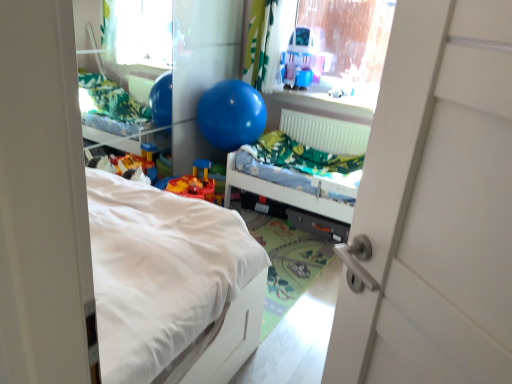
This screenshot has width=512, height=384. Describe the element at coordinates (325, 133) in the screenshot. I see `white plastic radiator at upper center` at that location.

The image size is (512, 384). Describe the element at coordinates (294, 185) in the screenshot. I see `blue rubber ball at center` at that location.

Measure the distance between translucent plastic playhouse at upper center and camera.

translucent plastic playhouse at upper center is 3.65 meters away from camera.

Where is `white plastic radiator at upper center`? This screenshot has height=384, width=512. white plastic radiator at upper center is located at coordinates (325, 133).

How many degrees apart are the facing directions of blue rubber balloon at upper center and green fabric curtain at upper center?

1.39 degrees.

Identify the location of curtain that is behind the blue rubber balloon at upper center. This screenshot has height=384, width=512. (259, 41).

Is blue rubber balloon at upper center outside of green fabric curtain at upper center?

blue rubber balloon at upper center is positioned outside green fabric curtain at upper center.

From a real-world perspective, is blue rubber balloon at upper center physically located above or below green fabric curtain at upper center?

From a real-world perspective, blue rubber balloon at upper center is physically below green fabric curtain at upper center.

In the image, is translucent plastic playhouse at upper center positioned in front of or behind transparent plastic window screen at upper center?

translucent plastic playhouse at upper center is behind transparent plastic window screen at upper center.

Does translucent plastic playhouse at upper center have a greater height compared to transparent plastic window screen at upper center?

No.

Is translucent plastic playhouse at upper center positioned with its back to transparent plastic window screen at upper center?

Yes, transparent plastic window screen at upper center is at the back of translucent plastic playhouse at upper center.

Considering the relative positions of translucent plastic playhouse at upper center and transparent plastic window screen at upper center in the image provided, is translucent plastic playhouse at upper center to the left of transparent plastic window screen at upper center from the viewer's perspective?

Yes, translucent plastic playhouse at upper center is to the left of transparent plastic window screen at upper center.

Choose the correct answer: Is green fabric curtain at upper center inside blue rubber ball at center or outside it?

green fabric curtain at upper center is located beyond the bounds of blue rubber ball at center.

From a real-world perspective, which is physically below, green fabric curtain at upper center or blue rubber ball at center?

blue rubber ball at center is physically lower.

Would you say green fabric curtain at upper center is a long distance from blue rubber ball at center?

No, green fabric curtain at upper center is in close proximity to blue rubber ball at center.

Consider the image. Considering the sizes of objects green fabric curtain at upper center and blue rubber ball at center in the image provided, who is taller, green fabric curtain at upper center or blue rubber ball at center?

green fabric curtain at upper center.

Is point (237, 168) closer to camera compared to point (312, 76)?

Yes, it is in front of point (312, 76).

Is blue rubber ball at center directly adjacent to translucent plastic playhouse at upper center?

There is a gap between blue rubber ball at center and translucent plastic playhouse at upper center.

From a real-world perspective, does blue rubber ball at center stand above translucent plastic playhouse at upper center?

No, from a real-world perspective, blue rubber ball at center is not over translucent plastic playhouse at upper center

Identify the location of toy on the right of blue rubber ball at center. The width and height of the screenshot is (512, 384). (303, 60).

Which object is wider, blue rubber balloon at upper center or translucent plastic playhouse at upper center?

blue rubber balloon at upper center is wider.

From the image's perspective, is blue rubber balloon at upper center below translucent plastic playhouse at upper center?

Yes.

Is blue rubber balloon at upper center beside translucent plastic playhouse at upper center?

No, blue rubber balloon at upper center is not touching translucent plastic playhouse at upper center.

Who is smaller, blue rubber balloon at upper center or translucent plastic playhouse at upper center?

translucent plastic playhouse at upper center.

Does translucent plastic playhouse at upper center have a lesser width compared to blue rubber balloon at upper center?

Indeed, translucent plastic playhouse at upper center has a lesser width compared to blue rubber balloon at upper center.

From a real-world perspective, which is physically below, translucent plastic playhouse at upper center or blue rubber balloon at upper center?

In real-world perspective, blue rubber balloon at upper center is lower.

Is blue rubber balloon at upper center at the back of translucent plastic playhouse at upper center?

Answer: No, translucent plastic playhouse at upper center is not facing away from blue rubber balloon at upper center.

Looking at this image, is translucent plastic playhouse at upper center with blue rubber balloon at upper center?

translucent plastic playhouse at upper center and blue rubber balloon at upper center are clearly separated.

Is point (273, 23) closer or farther from the camera than point (223, 138)?

Point (273, 23) appears to be farther away from the viewer than point (223, 138).

From the image's perspective, is green fabric curtain at upper center on blue rubber balloon at upper center?

Yes.

Choose the correct answer: Is green fabric curtain at upper center inside blue rubber balloon at upper center or outside it?

green fabric curtain at upper center is outside blue rubber balloon at upper center.

Does green fabric curtain at upper center appear on the left side of blue rubber balloon at upper center?

No.

Locate an element on the screen. The width and height of the screenshot is (512, 384). curtain behind the blue rubber balloon at upper center is located at coordinates click(259, 41).

Image resolution: width=512 pixels, height=384 pixels. I want to click on toy that appears below the transparent plastic window screen at upper center (from the image's perspective), so 303,60.

Estimate the real-world distances between objects in this image. Which object is closer to blue rubber balloon at upper center, transparent plastic window screen at upper center or white plastic radiator at upper center?

white plastic radiator at upper center is closer to blue rubber balloon at upper center.

Considering their positions, is blue rubber ball at center positioned further to translucent plastic playhouse at upper center than blue rubber balloon at upper center?

Based on the image, blue rubber ball at center appears to be further to translucent plastic playhouse at upper center.

Looking at the image, which one is located closer to translucent plastic playhouse at upper center, blue rubber balloon at upper center or blue rubber ball at center?

Among the two, blue rubber balloon at upper center is located nearer to translucent plastic playhouse at upper center.

When comparing their distances from green fabric curtain at upper center, does blue rubber ball at center or transparent plastic window screen at upper center seem further?

Based on the image, blue rubber ball at center appears to be further to green fabric curtain at upper center.

When comparing their distances from transparent plastic window screen at upper center, does white plastic radiator at upper center or translucent plastic playhouse at upper center seem closer?

translucent plastic playhouse at upper center is positioned closer to the anchor transparent plastic window screen at upper center.

Considering their positions, is blue rubber balloon at upper center positioned closer to transparent plastic window screen at upper center than blue rubber ball at center?

Among the two, blue rubber ball at center is located nearer to transparent plastic window screen at upper center.

Looking at the image, which one is located closer to translucent plastic playhouse at upper center, blue rubber ball at center or transparent plastic window screen at upper center?

Based on the image, transparent plastic window screen at upper center appears to be nearer to translucent plastic playhouse at upper center.

Estimate the real-world distances between objects in this image. Which object is further from blue rubber ball at center, translucent plastic playhouse at upper center or green fabric curtain at upper center?

green fabric curtain at upper center is further to blue rubber ball at center.

This screenshot has width=512, height=384. I want to click on radiator located between blue rubber balloon at upper center and transparent plastic window screen at upper center in the left-right direction, so click(x=325, y=133).

The image size is (512, 384). What are the coordinates of `radiator between transparent plastic window screen at upper center and blue rubber ball at center vertically` in the screenshot? It's located at (325, 133).

You are a GUI agent. You are given a task and a screenshot of the screen. Output one action in this format:
    pyautogui.click(x=<x>, y=<y>)
    Task: Click on the curtain located between blue rubber balloon at upper center and transparent plastic window screen at upper center in the left-right direction
    
    Given the screenshot: What is the action you would take?
    pyautogui.click(x=259, y=41)

Where is `toy that lies between green fabric curtain at upper center and blue rubber ball at center from top to bottom`? Image resolution: width=512 pixels, height=384 pixels. toy that lies between green fabric curtain at upper center and blue rubber ball at center from top to bottom is located at coordinates (303, 60).